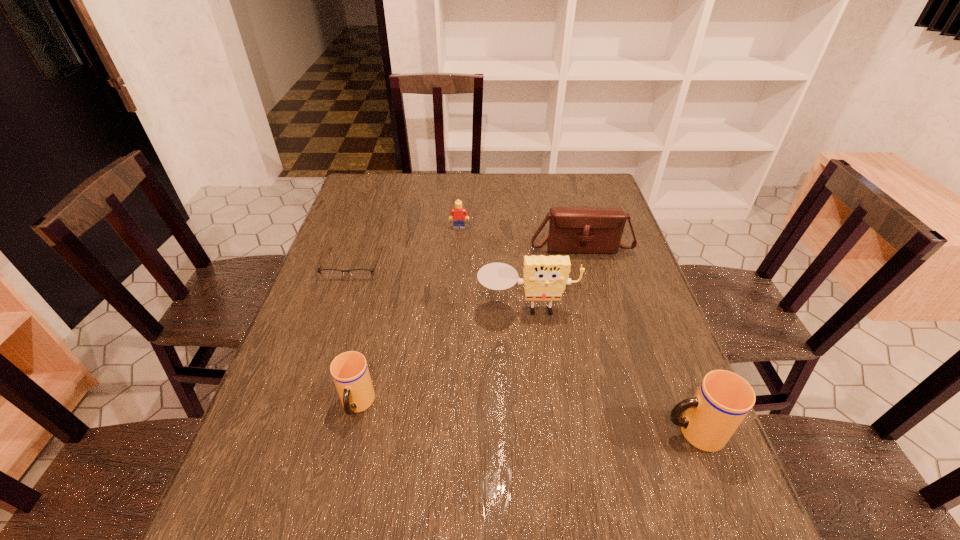
You are a GUI agent. You are given a task and a screenshot of the screen. Output one action in this format:
    pyautogui.click(x=<x>, y=<y>)
    Task: Click on the free space between the shorter cup and the shoulder bag
    This screenshot has width=960, height=540.
    Given the screenshot: What is the action you would take?
    pyautogui.click(x=468, y=326)

Locate an element on the screen. The width and height of the screenshot is (960, 540). unoccupied position between the third nearest object and the shortest object is located at coordinates (440, 286).

This screenshot has height=540, width=960. I want to click on free space between the sponge and the shorter cup, so pos(443,357).

Find the location of a particular element. This screenshot has width=960, height=540. vacant space that is in between the shorter cup and the spectacles is located at coordinates (355, 334).

At what (x,y) coordinates should I click in order to perform the action: click on vacant region between the farthest object and the taller cup. Please return your answer as a coordinate pair (x, y). This screenshot has height=540, width=960. Looking at the image, I should click on (576, 330).

Identify the location of object that is the closest to the sponge. (572, 230).

Choose which object is the fifth nearest neighbor to the shoulder bag. Please provide its 2D coordinates. Your answer should be formatted as a tuple, i.e. [(x, y)], where the tuple contains the x and y coordinates of a point satisfying the conditions above.

[(349, 370)]

What are the coordinates of `free space that satisfies the following two spatial constraints: 1. on the side of the right cup with the handle; 2. on the front-facing side of the Lego` in the screenshot? It's located at (614, 228).

The image size is (960, 540). What are the coordinates of `vacant space that satisfies the following two spatial constraints: 1. on the side of the right cup with the handle; 2. on the front flap of the shoulder bag` in the screenshot? It's located at (621, 246).

I want to click on vacant position in the image that satisfies the following two spatial constraints: 1. on the side of the right cup with the handle; 2. on the front-facing side of the second shortest object, so click(614, 228).